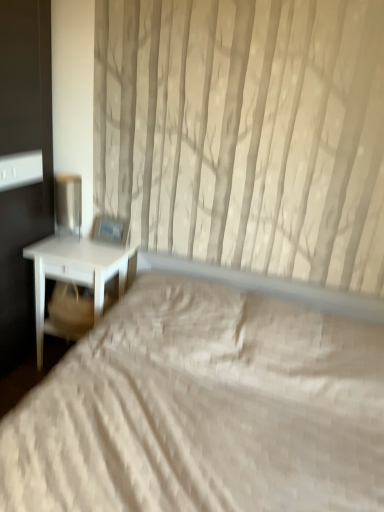
Question: Is white matte nightstand at left at the right side of white quilted bed at center?

Choices:
 (A) yes
 (B) no

Answer: (B)

Question: Can you confirm if white matte nightstand at left is shorter than white quilted bed at center?

Choices:
 (A) yes
 (B) no

Answer: (A)

Question: Is white matte nightstand at left bigger than white quilted bed at center?

Choices:
 (A) yes
 (B) no

Answer: (B)

Question: From a real-world perspective, is white matte nightstand at left located beneath white quilted bed at center?

Choices:
 (A) yes
 (B) no

Answer: (A)

Question: Considering the relative sizes of white matte nightstand at left and white quilted bed at center in the image provided, is white matte nightstand at left thinner than white quilted bed at center?

Choices:
 (A) no
 (B) yes

Answer: (B)

Question: Is point (115, 261) closer or farther from the camera than point (86, 309)?

Choices:
 (A) farther
 (B) closer

Answer: (B)

Question: Looking at the image, does white matte nightstand at left seem bigger or smaller compared to beige fabric swivel chair at left?

Choices:
 (A) big
 (B) small

Answer: (A)

Question: Choose the correct answer: Is white matte nightstand at left inside beige fabric swivel chair at left or outside it?

Choices:
 (A) inside
 (B) outside

Answer: (B)

Question: From a real-world perspective, is white matte nightstand at left physically located above or below beige fabric swivel chair at left?

Choices:
 (A) below
 (B) above

Answer: (A)

Question: Is point (64, 284) positioned closer to the camera than point (107, 265)?

Choices:
 (A) farther
 (B) closer

Answer: (A)

Question: From the image's perspective, is beige fabric swivel chair at left positioned above or below white matte nightstand at left?

Choices:
 (A) below
 (B) above

Answer: (B)

Question: Is beige fabric swivel chair at left wider or thinner than white matte nightstand at left?

Choices:
 (A) wide
 (B) thin

Answer: (B)

Question: Is beige fabric swivel chair at left situated inside white matte nightstand at left or outside?

Choices:
 (A) inside
 (B) outside

Answer: (A)

Question: Is metallic silver table lamp at left wider or thinner than beige fabric swivel chair at left?

Choices:
 (A) thin
 (B) wide

Answer: (A)

Question: Does point (59, 201) appear closer or farther from the camera than point (61, 303)?

Choices:
 (A) closer
 (B) farther

Answer: (B)